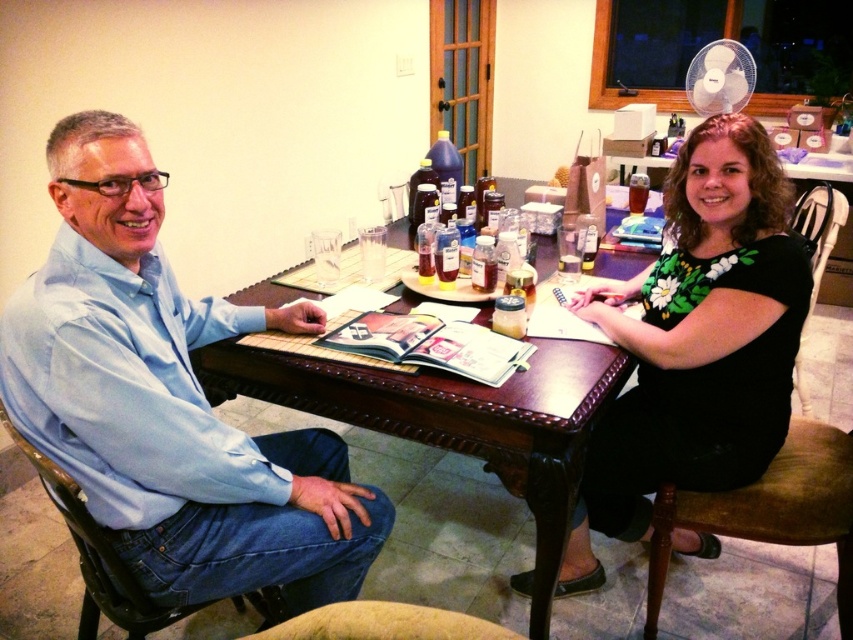
From the picture: Can you confirm if brown wooden table at center is positioned to the right of brown leather chair at lower center?

In fact, brown wooden table at center is to the left of brown leather chair at lower center.

Does brown wooden table at center have a lesser width compared to brown leather chair at lower center?

In fact, brown wooden table at center might be wider than brown leather chair at lower center.

In the scene shown: Who is more distant from viewer, (437, 429) or (445, 625)?

The point (437, 429) is behind.

You are a GUI agent. You are given a task and a screenshot of the screen. Output one action in this format:
    pyautogui.click(x=<x>, y=<y>)
    Task: Click on the brown wooden table at center
    
    Given the screenshot: What is the action you would take?
    pyautogui.click(x=456, y=420)

Is light blue shirt at left behind brown leather chair at lower center?

Yes, light blue shirt at left is behind brown leather chair at lower center.

The height and width of the screenshot is (640, 853). Describe the element at coordinates (167, 401) in the screenshot. I see `light blue shirt at left` at that location.

Between point (41, 394) and point (434, 614), which one is positioned in front?

Point (434, 614)

You are a GUI agent. You are given a task and a screenshot of the screen. Output one action in this format:
    pyautogui.click(x=<x>, y=<y>)
    Task: Click on the light blue shirt at left
    
    Given the screenshot: What is the action you would take?
    pyautogui.click(x=167, y=401)

Does black floral dress at center come behind brown wooden table at center?

Yes, black floral dress at center is further from the viewer.

Where is `black floral dress at center`? This screenshot has width=853, height=640. black floral dress at center is located at coordinates (697, 340).